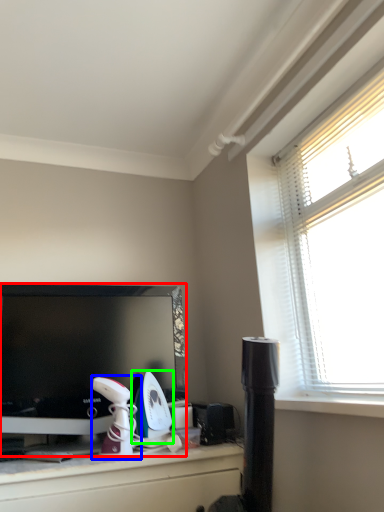
Question: Based on their relative distances, which object is nearer to television (highlighted by a red box)? Choose from appliance (highlighted by a blue box) and appliance (highlighted by a green box).

Choices:
 (A) appliance
 (B) appliance

Answer: (A)